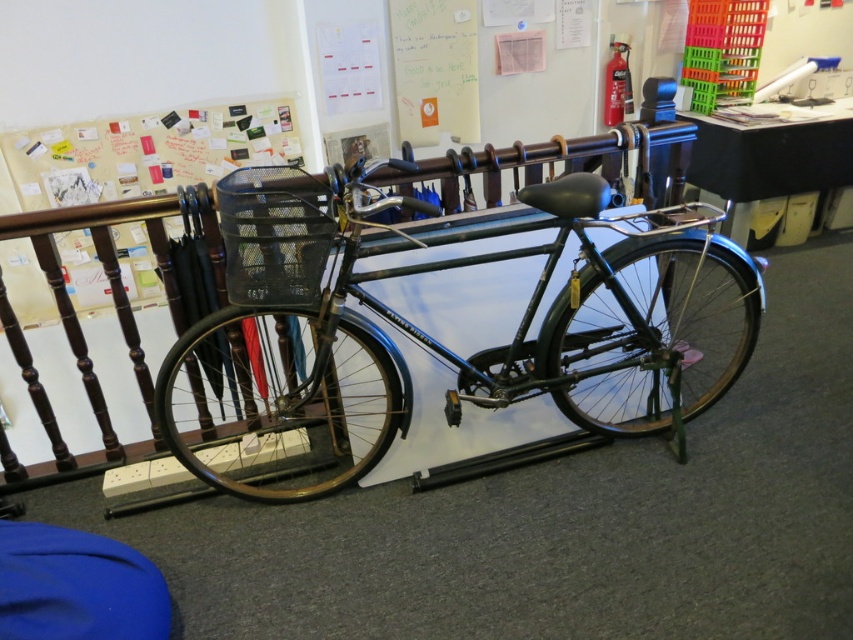
Who is positioned more to the left, shiny black bicycle at center or white paperboard at upper left?

white paperboard at upper left is more to the left.

Which is above, shiny black bicycle at center or white paperboard at upper left?

white paperboard at upper left

Find the location of a particular element. The height and width of the screenshot is (640, 853). shiny black bicycle at center is located at coordinates (426, 333).